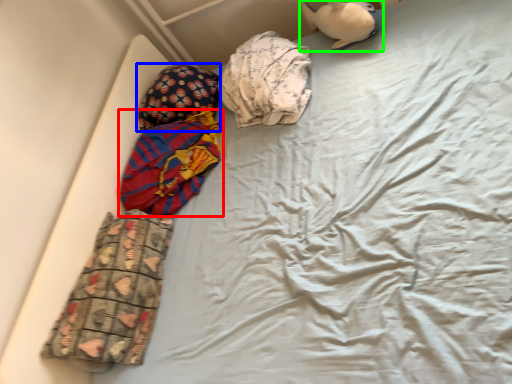
Question: Which object is the closest to the material (highlighted by a red box)? Choose among these: pillow (highlighted by a blue box) or toy (highlighted by a green box).

Choices:
 (A) pillow
 (B) toy

Answer: (A)